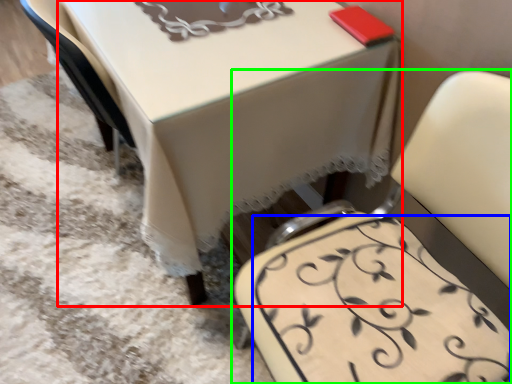
Question: Estimate the real-world distances between objects in this image. Which object is closer to table (highlighted by a red box), design (highlighted by a blue box) or chair (highlighted by a green box)?

Choices:
 (A) design
 (B) chair

Answer: (B)